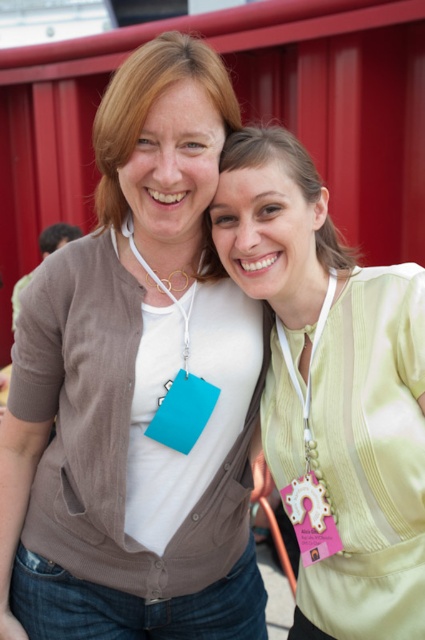
Question: Based on their relative distances, which object is nearer to the teal plastic lanyard at center?

Choices:
 (A) pink fabric badge at right
 (B) light green fabric at center

Answer: (A)

Question: Which is nearer to the matte white shirt at center?

Choices:
 (A) pink fabric badge at right
 (B) light green fabric at center

Answer: (B)

Question: Does light green fabric at center appear on the right side of pink fabric badge at right?

Choices:
 (A) no
 (B) yes

Answer: (B)

Question: Which object appears closest to the camera in this image?

Choices:
 (A) matte white shirt at center
 (B) teal plastic lanyard at center
 (C) pink fabric badge at right
 (D) light green fabric at center

Answer: (A)

Question: In this image, where is light green fabric at center located relative to pink fabric badge at right?

Choices:
 (A) above
 (B) below

Answer: (A)

Question: Can you confirm if matte white shirt at center is positioned below teal plastic lanyard at center?

Choices:
 (A) yes
 (B) no

Answer: (A)